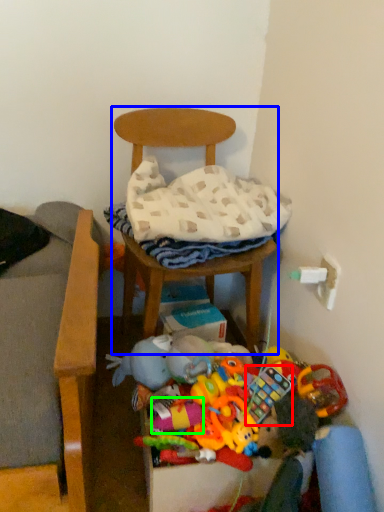
Question: Which is nearer to the toy (highlighted by a red box)? chair (highlighted by a blue box) or toy (highlighted by a green box).

Choices:
 (A) chair
 (B) toy

Answer: (B)